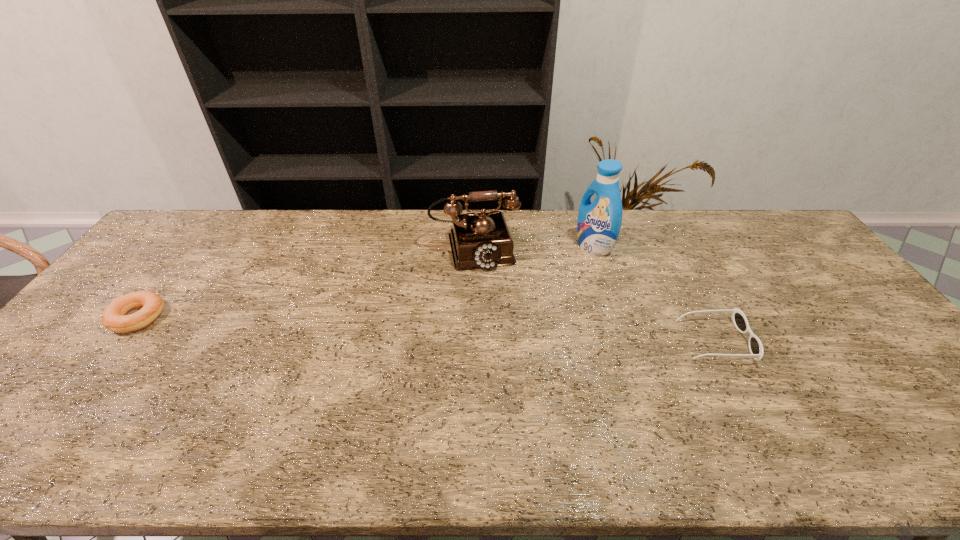
Locate an element on the screen. The width and height of the screenshot is (960, 540). free location located on the dial of the second tallest object is located at coordinates (498, 350).

Identify the location of blank space located 0.300m on the front-facing side of the detergent. The width and height of the screenshot is (960, 540). click(x=510, y=292).

Where is `vacant space located on the front-facing side of the detergent`? vacant space located on the front-facing side of the detergent is located at coordinates (505, 294).

Locate an element on the screen. The width and height of the screenshot is (960, 540). vacant space situated 0.370m on the front-facing side of the detergent is located at coordinates (492, 301).

Locate an element on the screen. This screenshot has width=960, height=540. telephone at the far edge is located at coordinates (482, 240).

Where is `detergent that is at the far edge`? This screenshot has width=960, height=540. detergent that is at the far edge is located at coordinates (598, 225).

The height and width of the screenshot is (540, 960). Find the location of `object located in the left edge section of the desktop`. object located in the left edge section of the desktop is located at coordinates (114, 317).

Where is `free space at the far edge of the desktop`? The width and height of the screenshot is (960, 540). free space at the far edge of the desktop is located at coordinates (294, 215).

Identify the location of vacant point at the near edge. This screenshot has height=540, width=960. (408, 402).

Identify the location of vacant space at the left edge of the desktop. (96, 375).